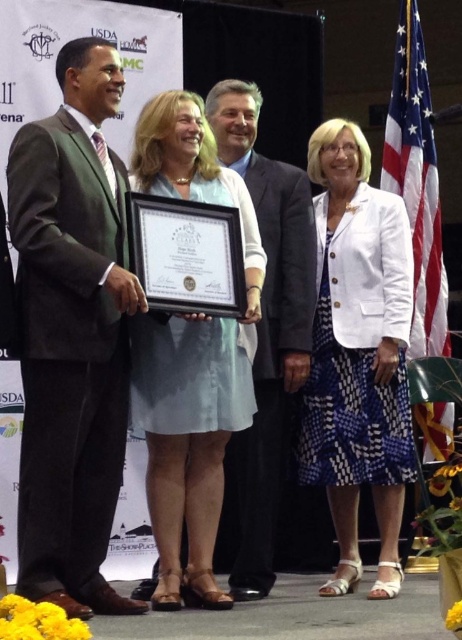
From the picture: Which is below, white textured blazer at center or light blue fabric dress at center?

Positioned lower is light blue fabric dress at center.

Does white textured blazer at center have a greater height compared to light blue fabric dress at center?

Yes, white textured blazer at center is taller than light blue fabric dress at center.

Who is more forward, (359, 369) or (211, 500)?

Point (211, 500)

Identify the location of white textured blazer at center. click(x=358, y=355).

Does point (109, 467) come behind point (395, 156)?

No, (109, 467) is in front of (395, 156).

Does green suit at left have a lesser width compared to american flag at right?

No.

The image size is (462, 640). Identify the location of green suit at left. (72, 333).

This screenshot has width=462, height=640. I want to click on green suit at left, so click(72, 333).

Based on the photo, is green suit at left to the right of light blue fabric dress at center from the viewer's perspective?

In fact, green suit at left is to the left of light blue fabric dress at center.

Is green suit at left to the left of light blue fabric dress at center from the viewer's perspective?

Yes, green suit at left is to the left of light blue fabric dress at center.

Image resolution: width=462 pixels, height=640 pixels. I want to click on green suit at left, so click(x=72, y=333).